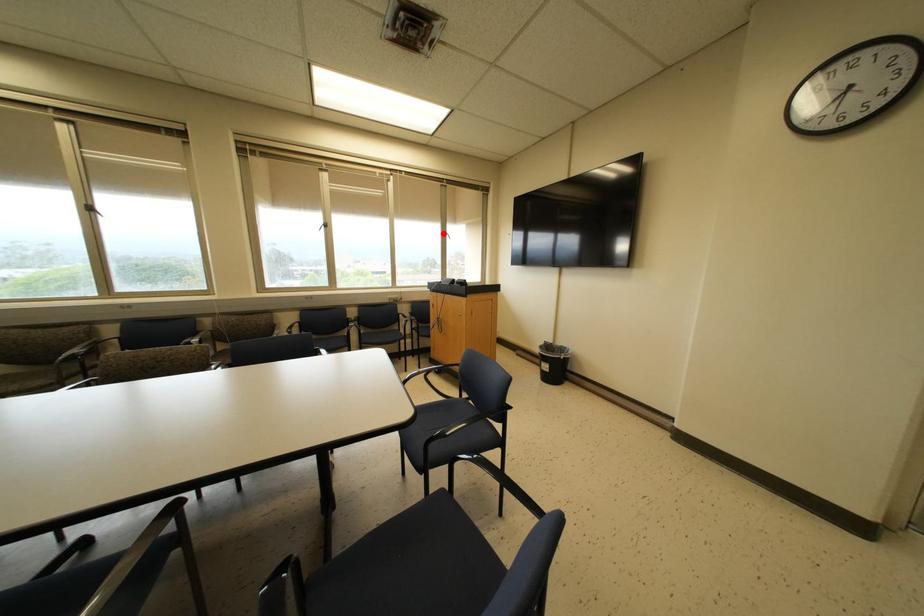
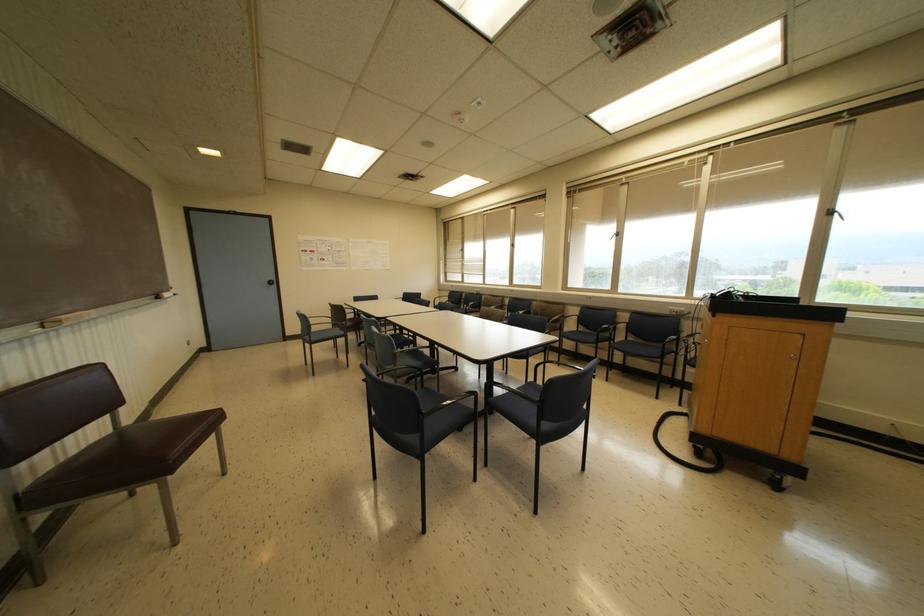
Question: I am providing you with two images of the same scene from different viewpoints. A red point is marked on the first image. Is the red point's position out of view in image 2?

Choices:
 (A) Yes
 (B) No

Answer: (B)